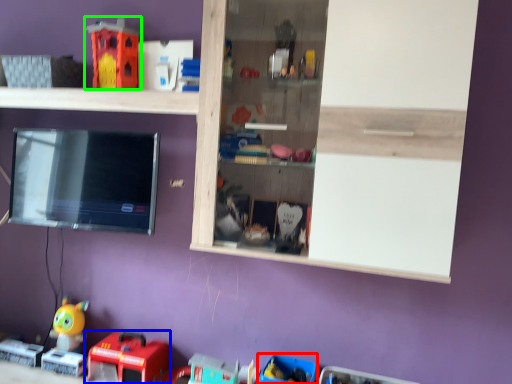
Question: Based on their relative distances, which object is farther from toy (highlighted by a red box)? Choose from toy (highlighted by a blue box) and toy (highlighted by a green box).

Choices:
 (A) toy
 (B) toy

Answer: (B)